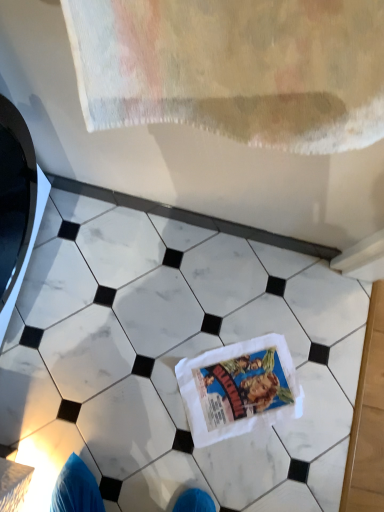
Question: From a real-world perspective, is white cotton comic book at center over white marble tile at center?

Choices:
 (A) yes
 (B) no

Answer: (A)

Question: From the image's perspective, would you say white cotton comic book at center is shown under white marble tile at center?

Choices:
 (A) no
 (B) yes

Answer: (B)

Question: Is the depth of white cotton comic book at center less than that of white marble tile at center?

Choices:
 (A) yes
 (B) no

Answer: (B)

Question: Does white cotton comic book at center have a larger size compared to white marble tile at center?

Choices:
 (A) yes
 (B) no

Answer: (B)

Question: Considering the relative sizes of white cotton comic book at center and white marble tile at center in the image provided, is white cotton comic book at center taller than white marble tile at center?

Choices:
 (A) yes
 (B) no

Answer: (B)

Question: Could you tell me if white cotton comic book at center is facing white marble tile at center?

Choices:
 (A) yes
 (B) no

Answer: (A)

Question: Is white marble tile at center completely or partially outside of white cotton comic book at center?

Choices:
 (A) yes
 (B) no

Answer: (A)

Question: From a real-world perspective, does white marble tile at center stand above white cotton comic book at center?

Choices:
 (A) yes
 (B) no

Answer: (B)

Question: Does white marble tile at center turn towards white cotton comic book at center?

Choices:
 (A) yes
 (B) no

Answer: (A)

Question: Does white marble tile at center have a greater width compared to white cotton comic book at center?

Choices:
 (A) yes
 (B) no

Answer: (A)

Question: Is white marble tile at center at the right side of white cotton comic book at center?

Choices:
 (A) yes
 (B) no

Answer: (B)

Question: From the image's perspective, is white marble tile at center located above white cotton comic book at center?

Choices:
 (A) no
 (B) yes

Answer: (B)

Question: In terms of height, does white marble tile at center look taller or shorter compared to white cotton comic book at center?

Choices:
 (A) tall
 (B) short

Answer: (A)